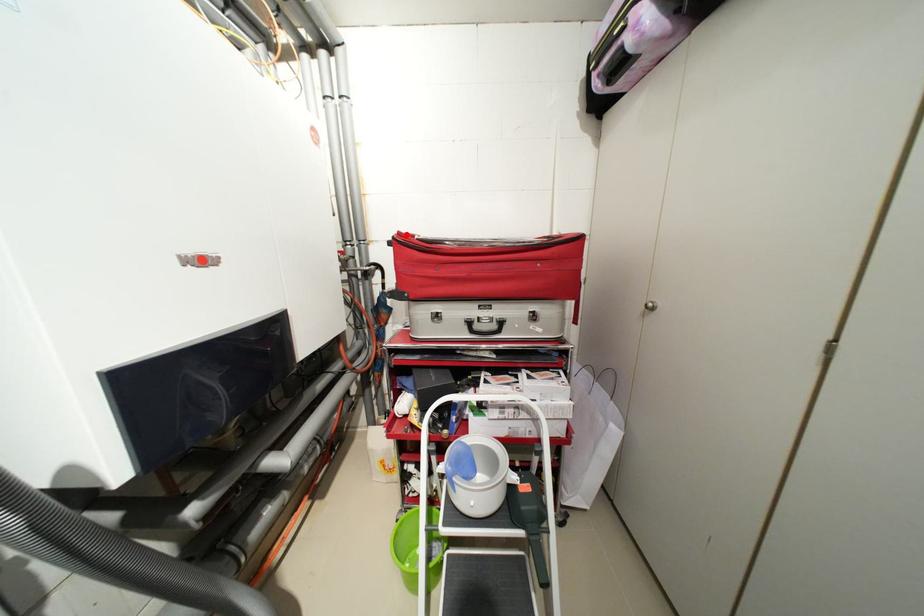
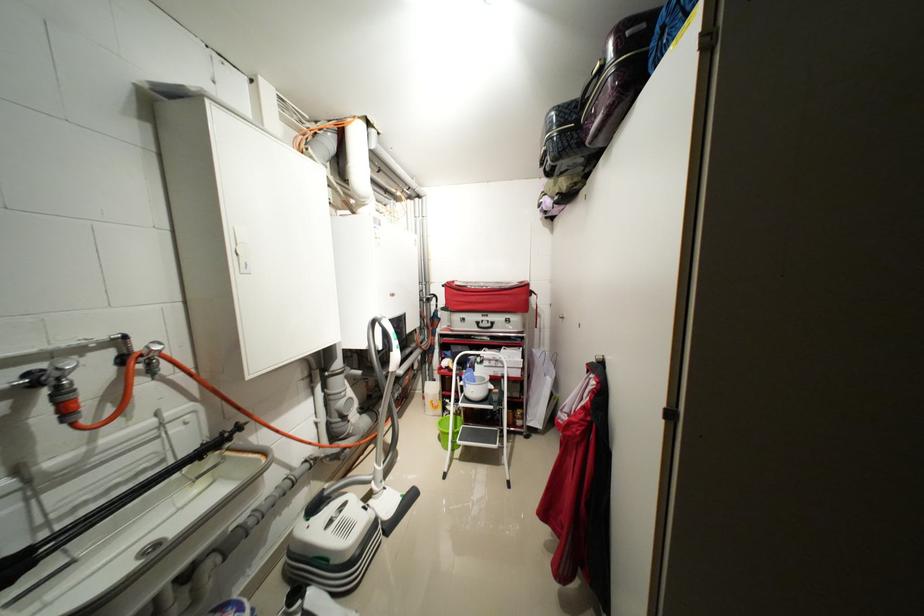
Locate, in the second image, the point that corresponds to the highlighted location in the first image.

(455, 284)